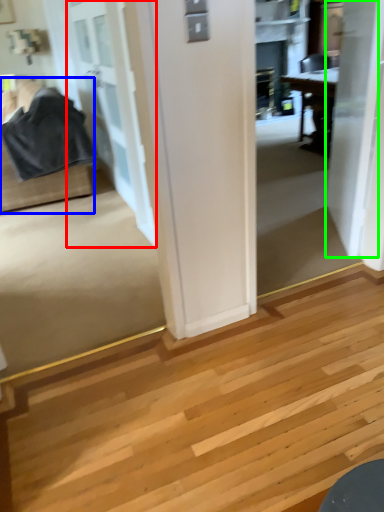
Question: Which object is positioned closest to door (highlighted by a red box)? Select from furniture (highlighted by a blue box) and door (highlighted by a green box).

Choices:
 (A) furniture
 (B) door

Answer: (A)